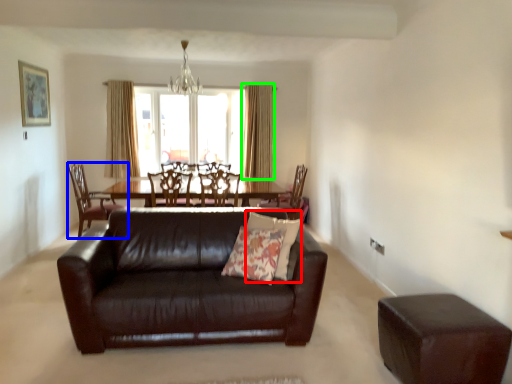
Question: Estimate the real-world distances between objects in this image. Which object is closer to pillow (highlighted by a red box), chair (highlighted by a blue box) or curtain (highlighted by a green box)?

Choices:
 (A) chair
 (B) curtain

Answer: (A)